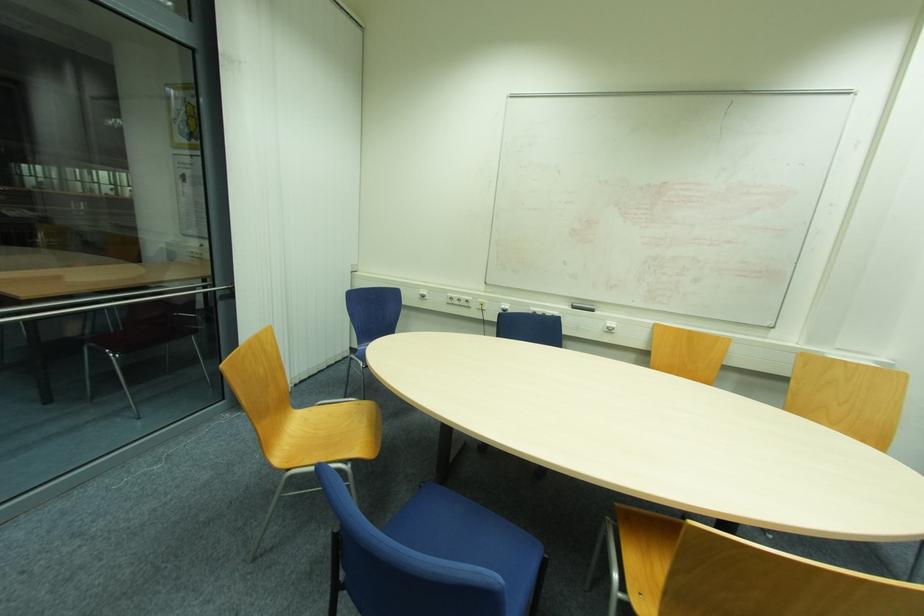
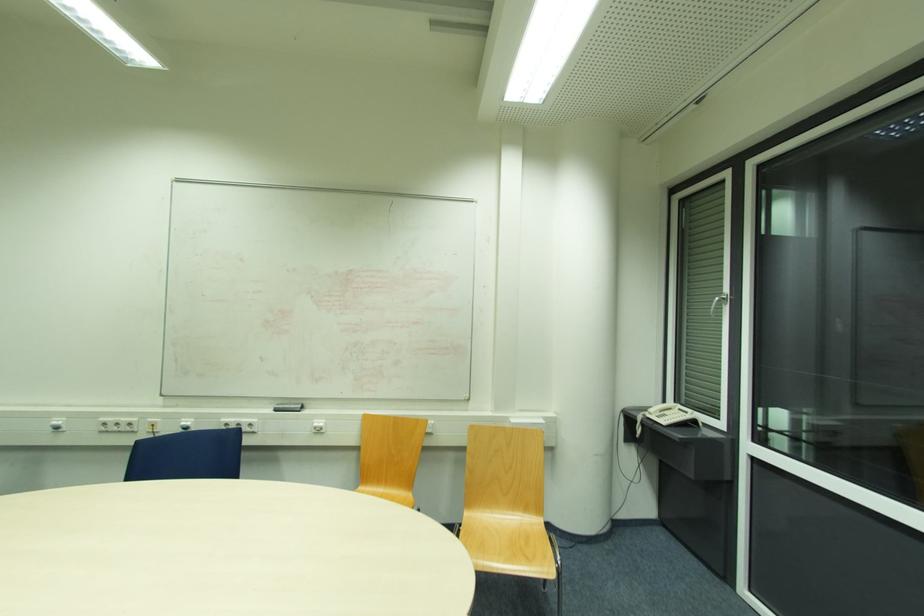
Locate, in the second image, the point that corresponds to (x=575, y=309) in the first image.

(276, 411)